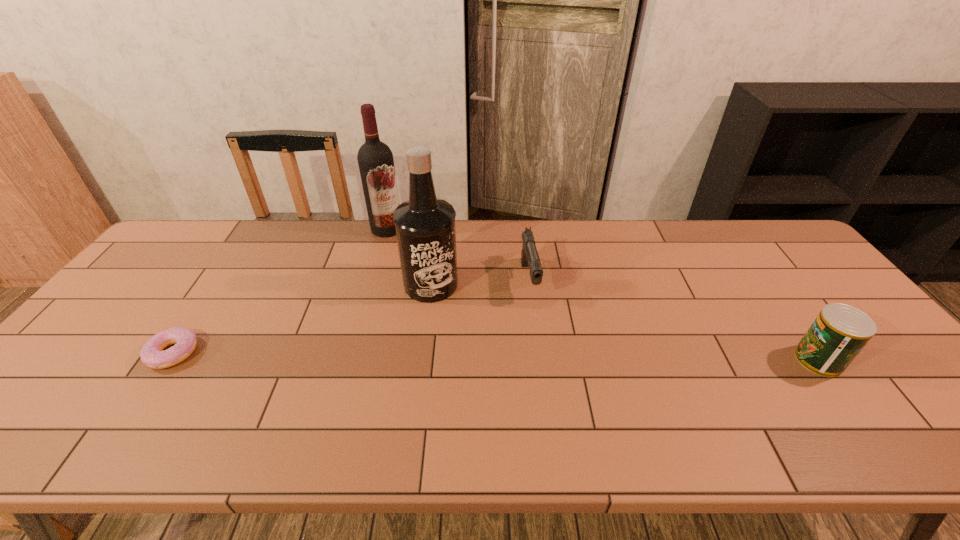
In order to click on free space located 0.100m on the front label of the third object from left to right in this screenshot , I will do `click(460, 324)`.

Where is `free spot located 0.210m on the front label of the third object from left to right`? This screenshot has width=960, height=540. free spot located 0.210m on the front label of the third object from left to right is located at coordinates (480, 352).

Locate an element on the screen. Image resolution: width=960 pixels, height=540 pixels. vacant space located 0.120m in the direction the second object from right to left is aimed is located at coordinates 540,339.

What are the coordinates of `vacant region located in the direction the second object from right to left is aimed` in the screenshot? It's located at (539, 333).

You are a GUI agent. You are given a task and a screenshot of the screen. Output one action in this format:
    pyautogui.click(x=<x>, y=<y>)
    Task: Click on the free space located in the direction the second object from right to left is aimed
    The width and height of the screenshot is (960, 540).
    Given the screenshot: What is the action you would take?
    pyautogui.click(x=537, y=324)

The image size is (960, 540). I want to click on blank space located on the label of the wine bottle, so click(x=398, y=305).

Where is `free space located on the label of the wine bottle`? free space located on the label of the wine bottle is located at coordinates (395, 280).

Locate an element on the screen. vacant space located on the label of the wine bottle is located at coordinates (396, 291).

What are the coordinates of `gun that is positioned at the far edge` in the screenshot? It's located at (529, 256).

You are a GUI agent. You are given a task and a screenshot of the screen. Output one action in this format:
    pyautogui.click(x=<x>, y=<y>)
    Task: Click on the wine bottle located at the far edge
    
    Given the screenshot: What is the action you would take?
    tap(375, 159)